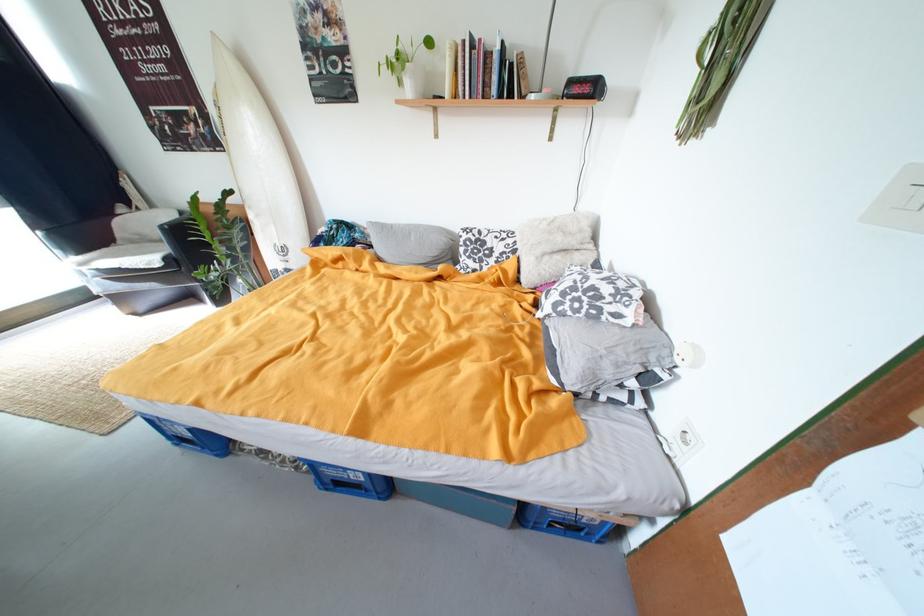
Find where to lift the white surfboard. Please return your answer as a coordinate pair (x, y).

(259, 164)